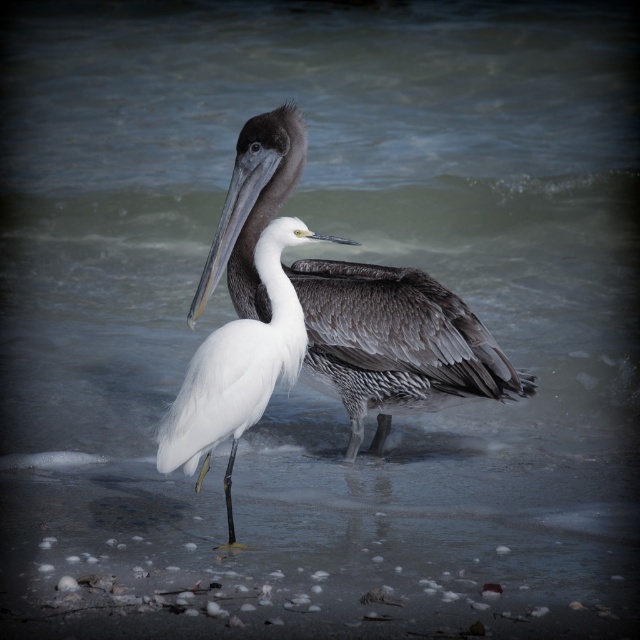
Is brown feathered pelican at center positioned in front of white feathered bird at center?

No, it is not.

Is brown feathered pelican at center below white feathered bird at center?

No, brown feathered pelican at center is not below white feathered bird at center.

Who is more distant from viewer, (316,342) or (196,403)?

Point (316,342)

Identify the location of brown feathered pelican at center. The height and width of the screenshot is (640, 640). (396, 342).